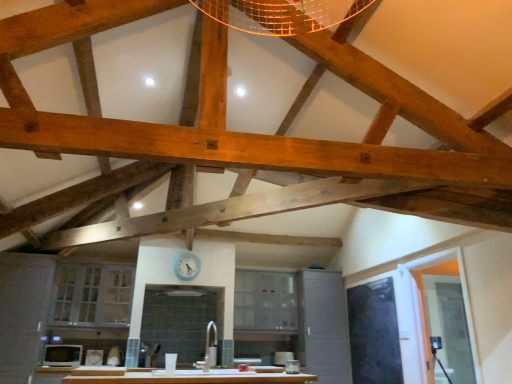
Question: From a real-world perspective, is white glossy sink at center above or below transparent glass door at right?

Choices:
 (A) below
 (B) above

Answer: (A)

Question: From the image's perspective, relative to transparent glass door at right, is white glossy sink at center above or below?

Choices:
 (A) below
 (B) above

Answer: (B)

Question: Estimate the real-world distances between objects in this image. Which object is farther from the matte gray cabinet at center, arranged as the 1th cabinetry when viewed from the right?

Choices:
 (A) white glass cabinet at lower left, positioned as the third cabinetry in right-to-left order
 (B) matte gray cabinet at center, which is the second cabinetry from left to right
 (C) blue glossy clock at upper center
 (D) white glossy sink at center
 (E) transparent glass door at right

Answer: (A)

Question: Which is nearer to the matte gray cabinet at center, which is counted as the 3th cabinetry, starting from the left?

Choices:
 (A) matte white microwave at lower left
 (B) white glass cabinet at lower left, the first cabinetry positioned from the left
 (C) white glossy sink at center
 (D) blue glossy clock at upper center
 (E) matte gray cabinet at center, which is the second cabinetry from left to right

Answer: (E)